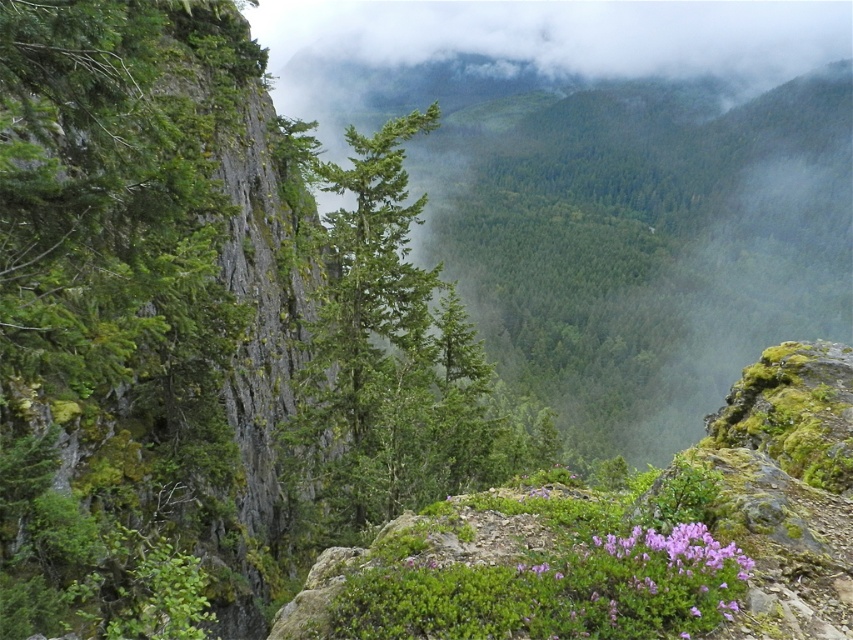
Which is behind, point (405, 481) or point (717, 548)?

Point (405, 481)

Who is more forward, (393, 515) or (708, 536)?

Point (708, 536) is in front.

Identify the location of green matte tree at center. click(x=392, y=362).